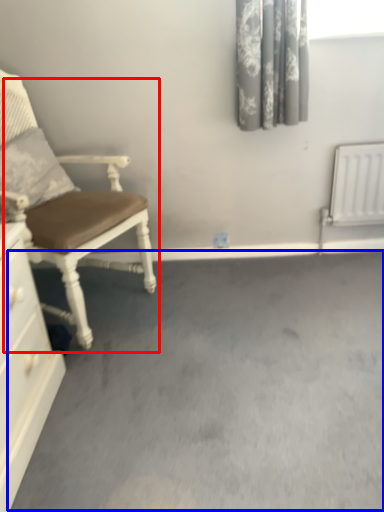
Question: Which object appears closest to the camera in this image, chair (highlighted by a red box) or concrete (highlighted by a blue box)?

Choices:
 (A) chair
 (B) concrete

Answer: (B)